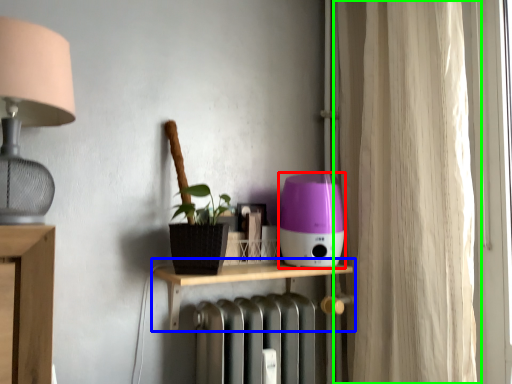
Question: Which object is the closest to the appliance (highlighted by a red box)? Choose among these: shelf (highlighted by a blue box) or curtain (highlighted by a green box).

Choices:
 (A) shelf
 (B) curtain

Answer: (A)